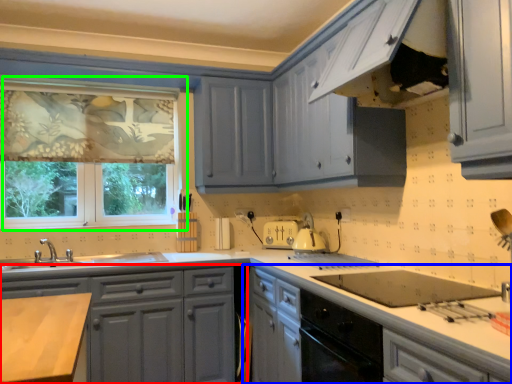
Question: Which object is the farthest from cabinetry (highlighted by a red box)? Choose among these: cabinetry (highlighted by a blue box) or window (highlighted by a green box).

Choices:
 (A) cabinetry
 (B) window

Answer: (B)